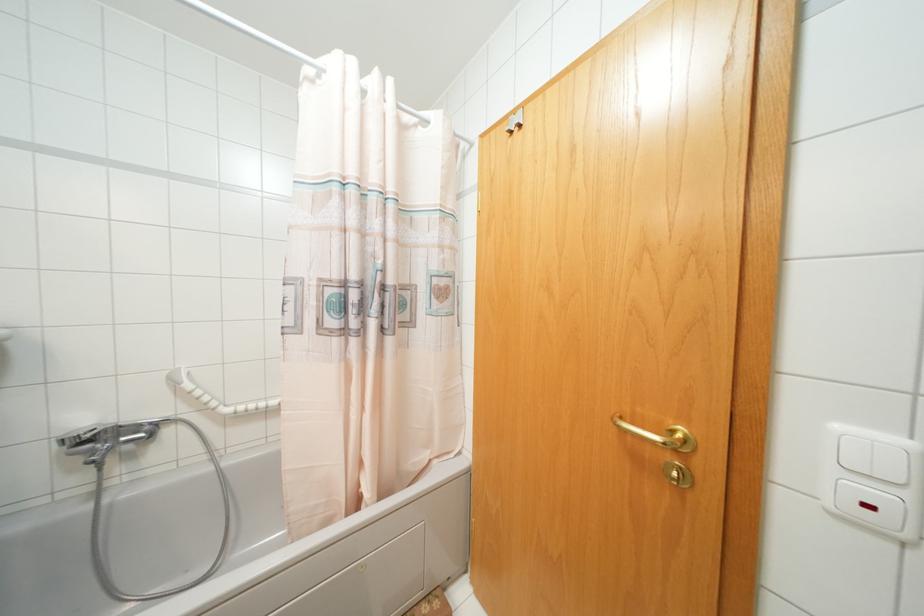
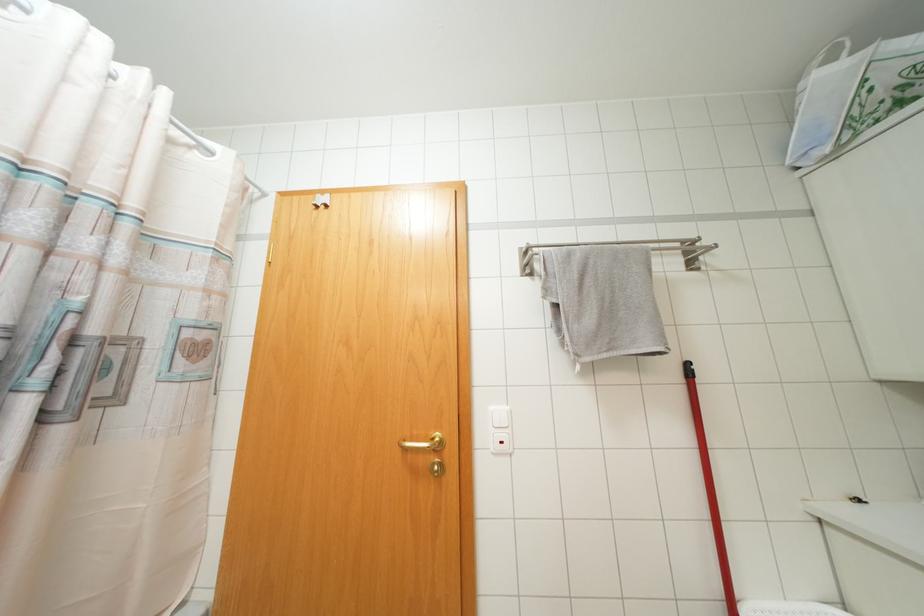
Question: The camera is either moving clockwise (left) or counter-clockwise (right) around the object. The first image is from the beginning of the video and the second image is from the end. Is the camera moving left or right when shooting the video?

Choices:
 (A) Left
 (B) Right

Answer: (A)